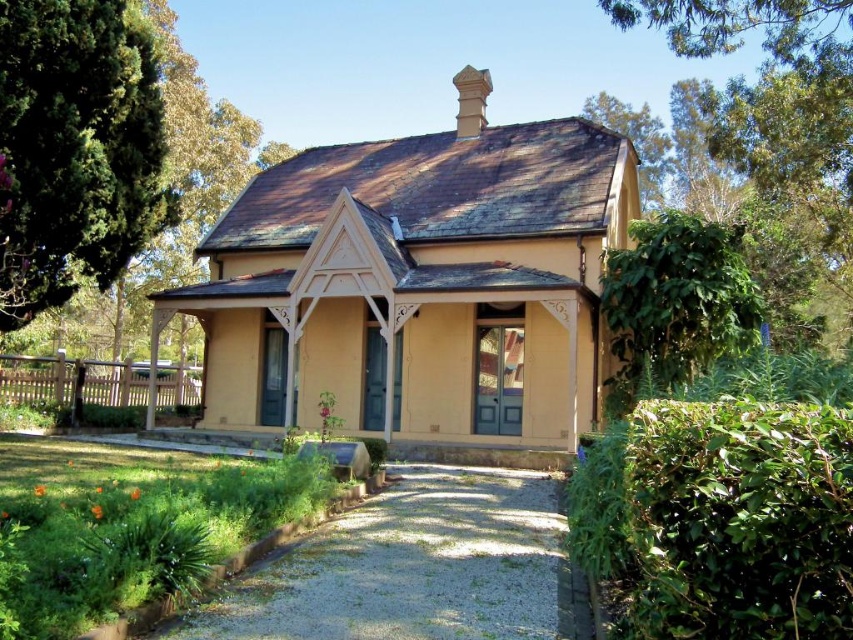
You are standing at the entrance of the house and want to place a decorative statue exactly at the center of the matte yellow house at center. Given that the coordinate system starts at the bottom left corner of the image, what are the coordinates where you should place the statue?

The coordinates for the center of the matte yellow house at center are given as point (418, 285), so you should place the statue at those coordinates.

You are standing at the entrance of the quaint house and want to take a photo of both the green leafy tree at left and the white wooden porch at lower left. Which object will appear larger in the photo?

The green leafy tree at left will appear larger in the photo because it is much taller than the white wooden porch at lower left.

You are a gardener planning to plant a new flower bed between the green leafy tree at left and the green leafy bush at upper right. Based on their sizes, which object would require more space for the flower bed to be placed next to it?

The green leafy bush at upper right requires more space for the flower bed since it occupies more space than the green leafy tree at left.